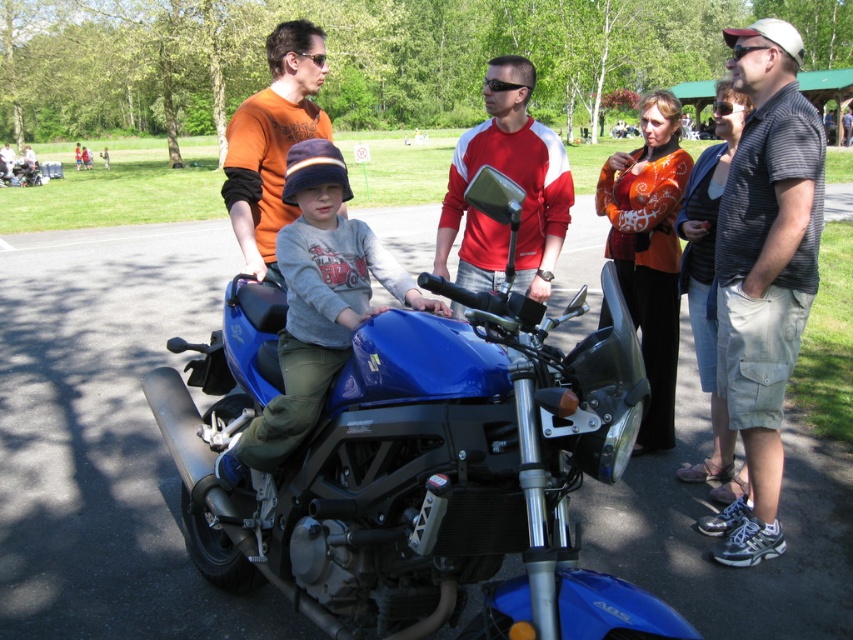
You are a photographer at the park and want to take a photo of the striped cotton shirt at right and the matte blue motorcycle at center. Which object is shorter in height?

The striped cotton shirt at right is shorter than the matte blue motorcycle at center.